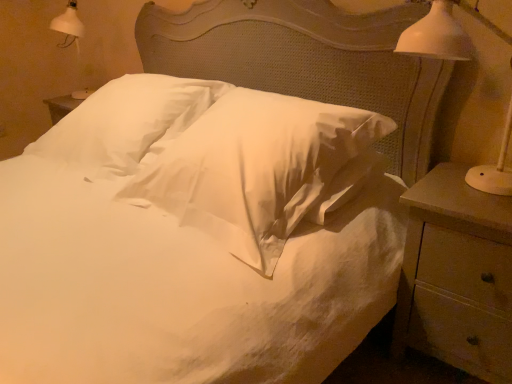
Question: From their relative heights in the image, would you say white satin pillow at center, which is the second pillow in left-to-right order, is taller or shorter than white ceramic lamp at right?

Choices:
 (A) tall
 (B) short

Answer: (B)

Question: Is white satin pillow at center, which is counted as the 1th pillow, starting from the right, wider or thinner than white ceramic lamp at right?

Choices:
 (A) wide
 (B) thin

Answer: (A)

Question: Which is farther from the wooden nightstand at right?

Choices:
 (A) white soft pillow at center, placed as the 1th pillow when sorted from left to right
 (B) white satin pillow at center, which is the second pillow in left-to-right order
 (C) white ceramic lamp at right

Answer: (A)

Question: Which object is the farthest from the white soft pillow at center, placed as the 1th pillow when sorted from left to right?

Choices:
 (A) white ceramic lamp at right
 (B) white satin pillow at center, which is counted as the 1th pillow, starting from the right
 (C) wooden nightstand at right

Answer: (A)